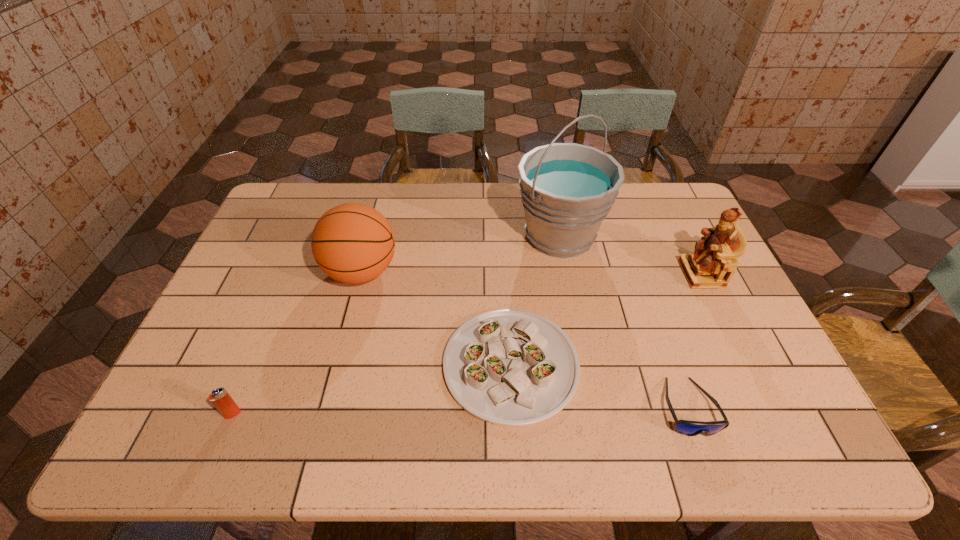
Find the location of a particular element. The width and height of the screenshot is (960, 540). blank region between the rightmost object and the platter is located at coordinates (606, 319).

At what (x,y) coordinates should I click in order to perform the action: click on vacant area between the second object from right to left and the bucket. Please return your answer as a coordinate pair (x, y). The width and height of the screenshot is (960, 540). Looking at the image, I should click on (624, 321).

You are a GUI agent. You are given a task and a screenshot of the screen. Output one action in this format:
    pyautogui.click(x=<x>, y=<y>)
    Task: Click on the empty space between the figurine and the sunglasses
    
    Given the screenshot: What is the action you would take?
    [695, 341]

Find the location of a particular element. empty location between the bucket and the basketball is located at coordinates (461, 254).

At what (x,y) coordinates should I click in order to perform the action: click on free area in between the igniter and the sunglasses. Please return your answer as a coordinate pair (x, y). Looking at the image, I should click on (461, 411).

Where is `object identified as the second closest to the tallest object`? object identified as the second closest to the tallest object is located at coordinates (713, 263).

Choose which object is the third nearest neighbor to the rightmost object. Please provide its 2D coordinates. Your answer should be formatted as a tuple, i.e. [(x, y)], where the tuple contains the x and y coordinates of a point satisfying the conditions above.

[(508, 367)]

Locate an element on the screen. free region that satisfies the following two spatial constraints: 1. on the front-facing side of the figurine; 2. on the front-facing side of the second object from right to left is located at coordinates (766, 407).

Identify the location of vacant space that satisfies the following two spatial constraints: 1. on the back side of the fifth object from right to left; 2. on the right side of the tallest object. (371, 236).